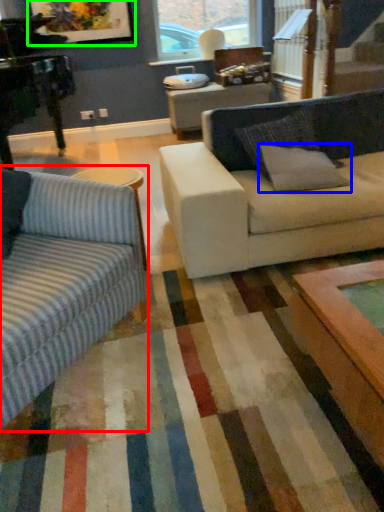
Question: Considering the real-world distances, which object is farthest from studio couch (highlighted by a red box)? pillow (highlighted by a blue box) or picture frame (highlighted by a green box)?

Choices:
 (A) pillow
 (B) picture frame

Answer: (B)